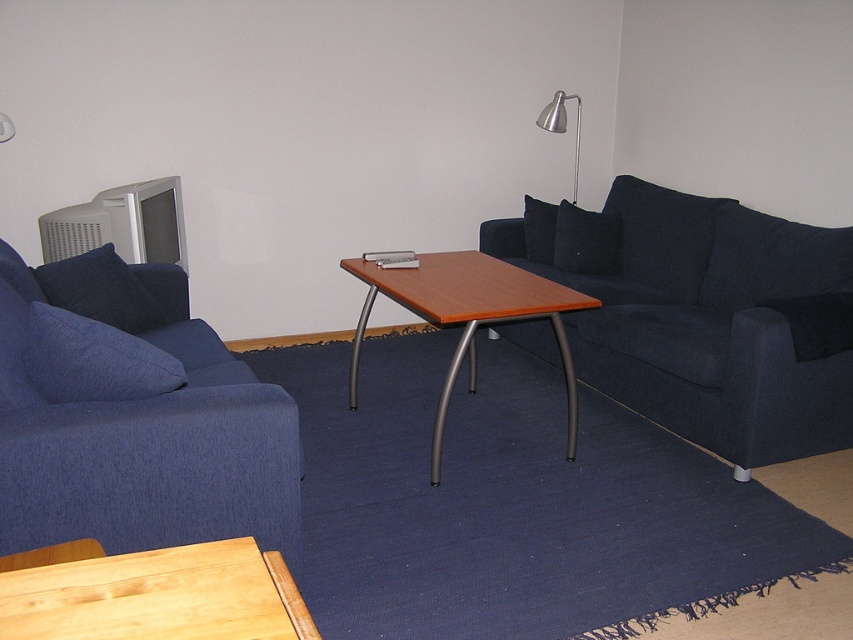
Can you confirm if wooden/metallic side table at center is thinner than black fabric pillow at center?

No, wooden/metallic side table at center is not thinner than black fabric pillow at center.

Is wooden/metallic side table at center positioned at the back of black fabric pillow at center?

No, it is in front of black fabric pillow at center.

Is point (576, 291) behind point (550, 204)?

No.

Find the location of `wooden/metallic side table at center`. wooden/metallic side table at center is located at coordinates (468, 316).

Is denim cushion at left above black fabric pillow at center?

No.

Who is more distant from viewer, (35, 388) or (549, 232)?

Positioned behind is point (549, 232).

The width and height of the screenshot is (853, 640). I want to click on denim cushion at left, so click(x=91, y=358).

Looking at this image, can you confirm if light brown wooden table at lower left is positioned to the left of metallic silver lamp at upper right?

Yes, light brown wooden table at lower left is to the left of metallic silver lamp at upper right.

Can you confirm if light brown wooden table at lower left is shorter than metallic silver lamp at upper right?

Yes.

Who is more forward, (97, 596) or (544, 108)?

Point (97, 596) is more forward.

Locate an element on the screen. Image resolution: width=853 pixels, height=640 pixels. light brown wooden table at lower left is located at coordinates (157, 596).